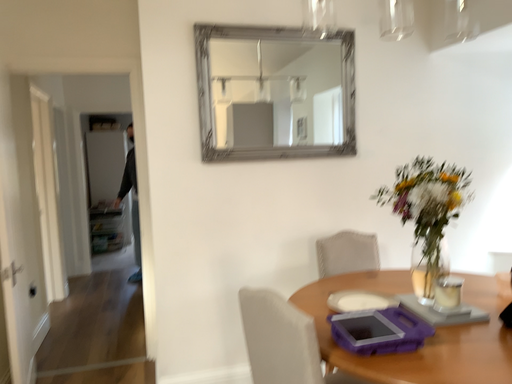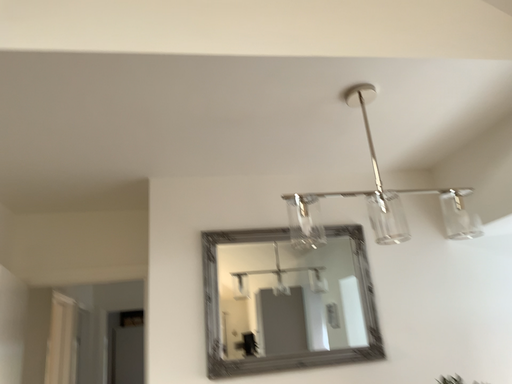
Question: Which way did the camera rotate in the video?

Choices:
 (A) rotated upward
 (B) rotated downward

Answer: (A)